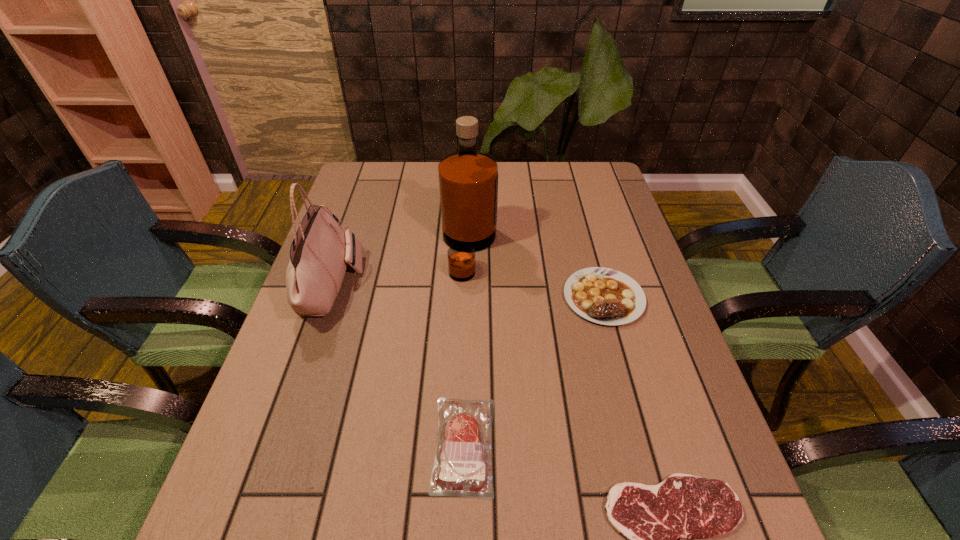
You are a GUI agent. You are given a task and a screenshot of the screen. Output one action in this format:
    pyautogui.click(x=<x>, y=<y>)
    Task: Click on the vacant area in the image that satisfies the following two spatial constraints: 1. on the front label of the liquor; 2. on the back side of the leftmost steak
    The height and width of the screenshot is (540, 960).
    Given the screenshot: What is the action you would take?
    pyautogui.click(x=464, y=445)

Find the location of a particular element. vacant region that satisfies the following two spatial constraints: 1. on the front label of the farthest steak; 2. on the left side of the liquor is located at coordinates (468, 297).

Find the location of `vacant area that satisfies the following two spatial constraints: 1. on the back side of the farthest steak; 2. on the side of the fourth shortest object with the attached pouch`. vacant area that satisfies the following two spatial constraints: 1. on the back side of the farthest steak; 2. on the side of the fourth shortest object with the attached pouch is located at coordinates (600, 285).

Where is `free point that satisfies the following two spatial constraints: 1. on the front label of the liquor; 2. on the back side of the third shortest object`? free point that satisfies the following two spatial constraints: 1. on the front label of the liquor; 2. on the back side of the third shortest object is located at coordinates (468, 297).

Identify the location of vacant area that satisfies the following two spatial constraints: 1. on the back side of the leftmost steak; 2. on the side of the second tallest object with the attached pouch. (468, 285).

Identify the location of free space that satisfies the following two spatial constraints: 1. on the side of the second tallest object with the attached pouch; 2. on the back side of the tallest steak. The image size is (960, 540). (328, 297).

Where is `free space that satisfies the following two spatial constraints: 1. on the front label of the second shortest object; 2. on the left side of the liquor`? This screenshot has width=960, height=540. free space that satisfies the following two spatial constraints: 1. on the front label of the second shortest object; 2. on the left side of the liquor is located at coordinates (464, 445).